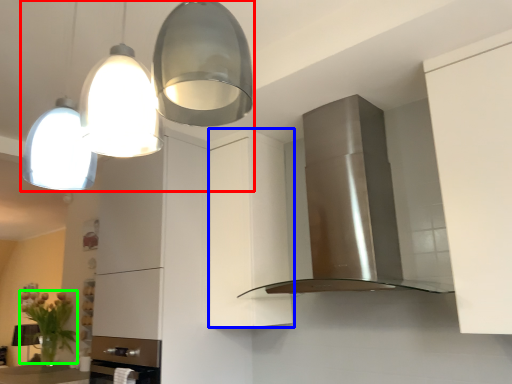
Question: Estimate the real-world distances between objects in this image. Which object is closer to light fixture (highlighted by a red box), cabinetry (highlighted by a blue box) or plant (highlighted by a green box)?

Choices:
 (A) cabinetry
 (B) plant

Answer: (A)